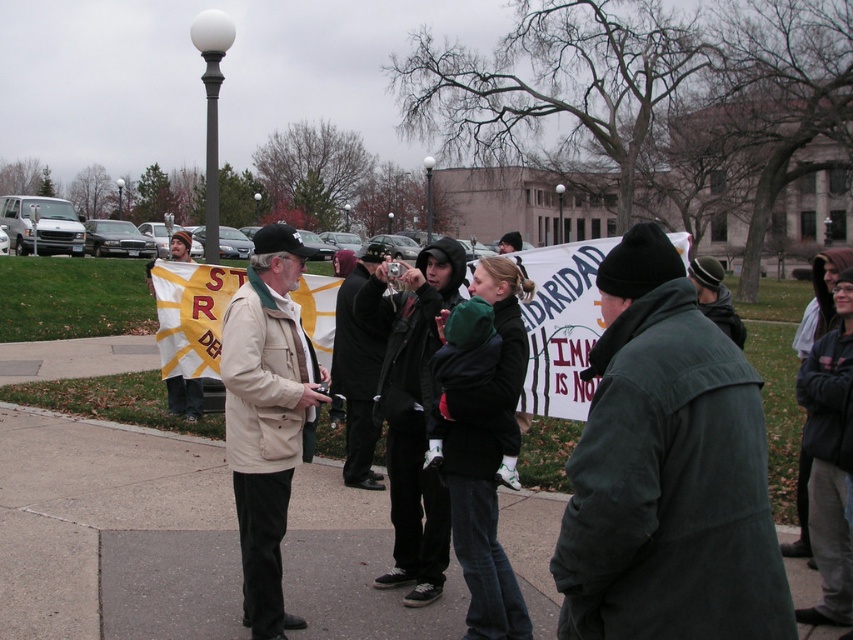
You are a photographer trying to capture the scene of the protest. You notice two items of clothing at the center of the image. Which item is positioned to the left of the other? The items are the dark gray coat at center and the dark green knit cap at center.

The dark gray coat at center is to the left of the dark green knit cap at center.

You are a photographer trying to capture a wide shot of the beige fabric jacket at center and the yellow and white striped banner at center. Based on their sizes, which object should you focus on to ensure both fit in the frame?

The beige fabric jacket at center is wider than the yellow and white striped banner at center. To ensure both fit in the frame, focus on the beige fabric jacket at center as it is the wider object.

You are a photographer trying to capture a clear shot of both the dark green jacket at center and the dark green knit cap at center in the same frame. Based on their heights, which object should you focus on first to ensure both are in the frame?

The dark green jacket at center is much taller than the dark green knit cap at center. Therefore, you should focus on the dark green knit cap at center first to ensure both are in the frame since it is shorter and positioned lower, allowing the taller jacket to naturally fall into the composition.